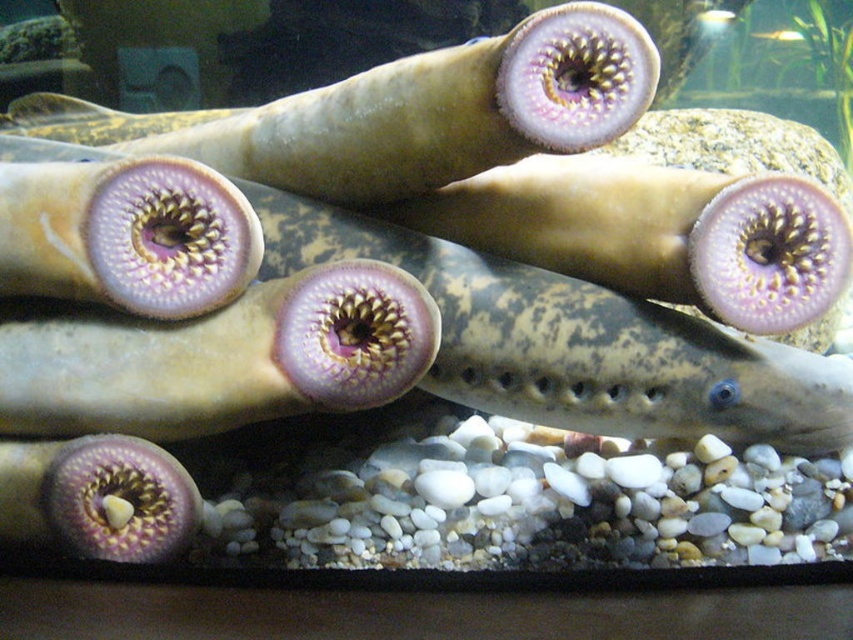
You are observing the lampreys in the image and notice two points marked on their bodies. The points are labeled as point 1 at coordinates point (550,353) and point 2 at coordinates point (61,337). Based on their positions, which point is closer to your eyes?

Point (550,353) is further to the viewer than point (61,337), so point (61,337) is closer to your eyes.